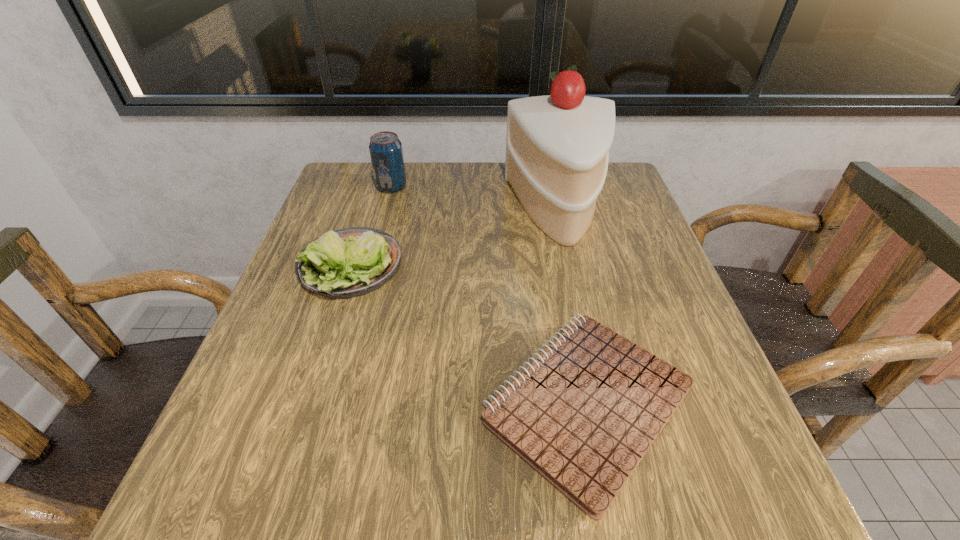
What are the coordinates of `pop soda that is at the far edge` in the screenshot? It's located at (385, 148).

You are a GUI agent. You are given a task and a screenshot of the screen. Output one action in this format:
    pyautogui.click(x=<x>, y=<y>)
    Task: Click on the object present at the near edge
    The width and height of the screenshot is (960, 540).
    Given the screenshot: What is the action you would take?
    pyautogui.click(x=583, y=414)

The width and height of the screenshot is (960, 540). What are the coordinates of `pop soda positioned at the left edge` in the screenshot? It's located at (385, 148).

Find the location of `lettuce that is at the left edge`. lettuce that is at the left edge is located at coordinates (350, 262).

I want to click on cake positioned at the right edge, so click(x=557, y=147).

Locate an element on the screen. notebook at the right edge is located at coordinates (583, 414).

You are a GUI agent. You are given a task and a screenshot of the screen. Output one action in this format:
    pyautogui.click(x=<x>, y=<y>)
    Task: Click on the object at the far left corner
    Image resolution: width=960 pixels, height=540 pixels.
    Given the screenshot: What is the action you would take?
    pyautogui.click(x=385, y=148)

Where is `object situated at the far right corner`? The image size is (960, 540). object situated at the far right corner is located at coordinates (557, 147).

In order to click on object located at the near right corner in this screenshot , I will do `click(583, 414)`.

You are a GUI agent. You are given a task and a screenshot of the screen. Output one action in this format:
    pyautogui.click(x=<x>, y=<y>)
    Task: Click on the vacant space at the far edge of the desktop
    The width and height of the screenshot is (960, 540).
    Given the screenshot: What is the action you would take?
    pyautogui.click(x=419, y=191)